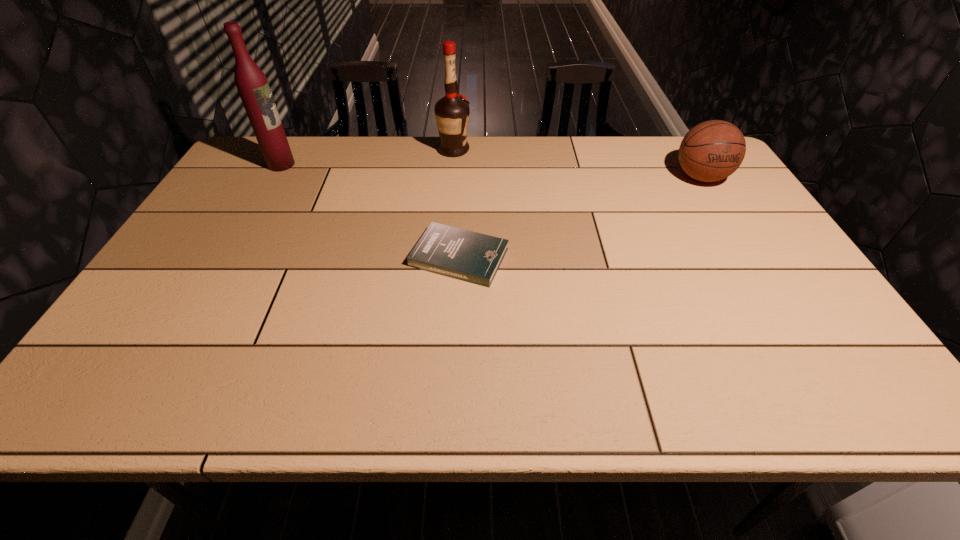
Find the location of a particular element. The height and width of the screenshot is (540, 960). free region located on the side with brand label of the basketball is located at coordinates (770, 288).

This screenshot has height=540, width=960. Identify the location of free space located on the left of the book. (272, 257).

The image size is (960, 540). What are the coordinates of `basketball that is at the far edge` in the screenshot? It's located at (711, 151).

This screenshot has height=540, width=960. In order to click on object present at the left edge in this screenshot , I will do `click(253, 87)`.

Locate an element on the screen. Image resolution: width=960 pixels, height=540 pixels. object situated at the right edge is located at coordinates (711, 151).

Locate an element on the screen. The image size is (960, 540). object located at the far left corner is located at coordinates (253, 87).

You are a GUI agent. You are given a task and a screenshot of the screen. Output one action in this format:
    pyautogui.click(x=<x>, y=<y>)
    Task: Click on the object at the far right corner
    
    Given the screenshot: What is the action you would take?
    pyautogui.click(x=711, y=151)

Locate an element on the screen. This screenshot has height=540, width=960. vacant area at the far edge of the desktop is located at coordinates (420, 174).

At what (x,y) coordinates should I click in order to perform the action: click on free space at the near edge of the desktop. Please return your answer as a coordinate pair (x, y). Looking at the image, I should click on (319, 386).

I want to click on free region at the left edge, so click(212, 255).